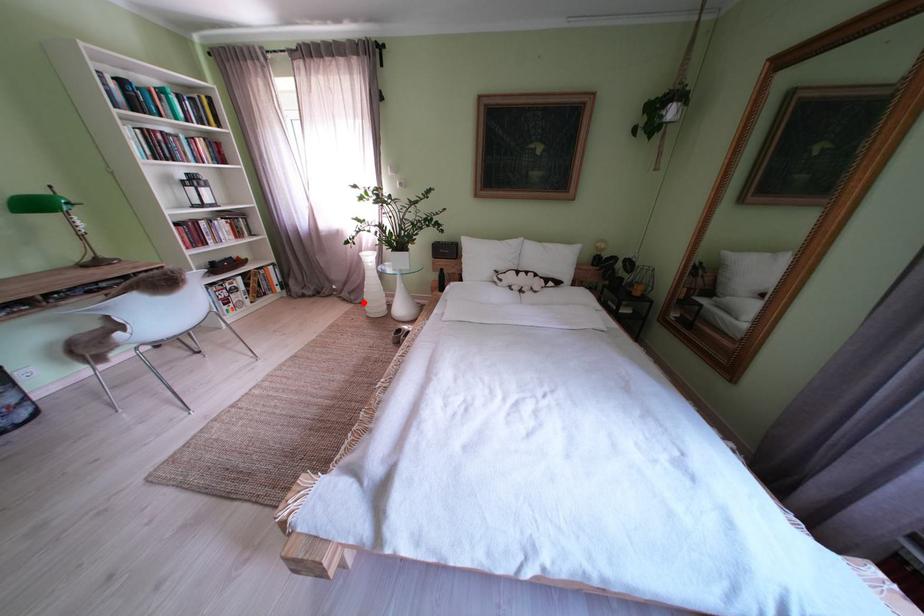
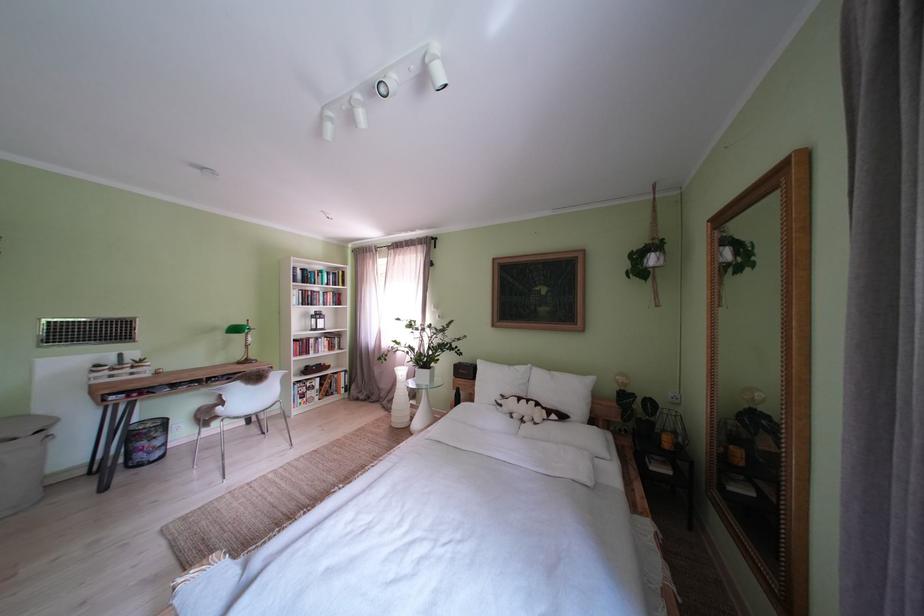
In the second image, find the point that corresponds to the highlighted location in the first image.

(400, 411)